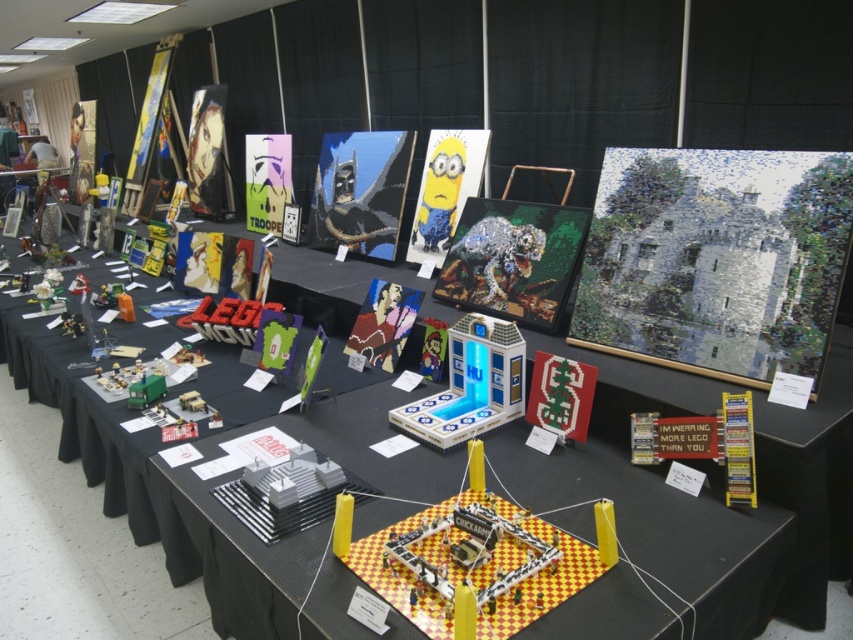
Question: Which of the following is the farthest from the observer?

Choices:
 (A) matte plastic lego minifigure at center
 (B) matte green car at center
 (C) yellow plastic lego structure at center
 (D) white mosaic castle at center

Answer: (A)

Question: Is white mosaic castle at center thinner than brick-like lego structure at center?

Choices:
 (A) yes
 (B) no

Answer: (A)

Question: Is white plastic building at center above matte green car at center?

Choices:
 (A) no
 (B) yes

Answer: (B)

Question: Which object is positioned farthest from the matte green car at center?

Choices:
 (A) minion toy at center
 (B) brick-like lego structure at center
 (C) green plastic toy at center

Answer: (A)

Question: Which object is the farthest from the brick-like lego structure at center?

Choices:
 (A) matte plastic lego minifigure at center
 (B) matte green car at center

Answer: (A)

Question: Can you confirm if yellow plastic lego structure at center is smaller than shiny metallic batman mask at center?

Choices:
 (A) yes
 (B) no

Answer: (A)